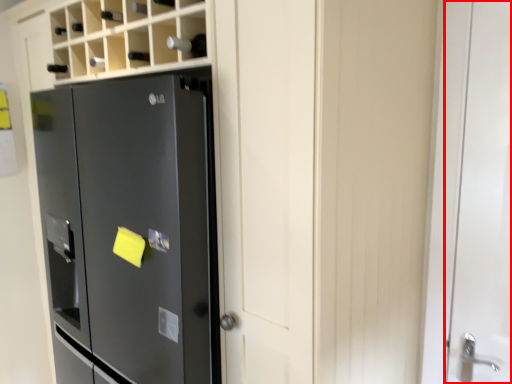
Question: From the image's perspective, what is the correct spatial positioning of door (annotated by the red box) in reference to refrigerator?

Choices:
 (A) below
 (B) above

Answer: (B)